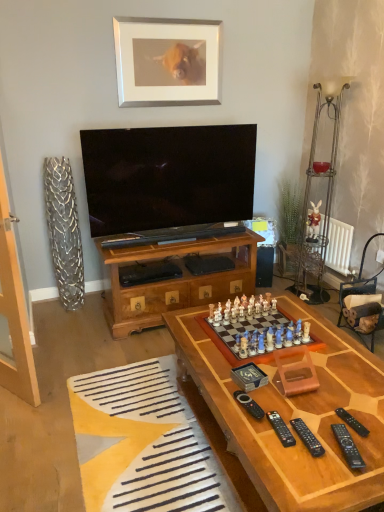
Locate an element on the screen. vacant area on the back side of black plastic remote at lower right, which is the 2th remote from left to right is located at coordinates pos(276,402).